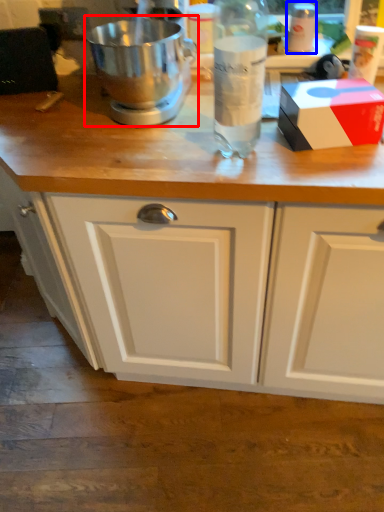
Question: Which point is further to the camera, mixer (highlighted by a red box) or bottle (highlighted by a blue box)?

Choices:
 (A) mixer
 (B) bottle

Answer: (B)